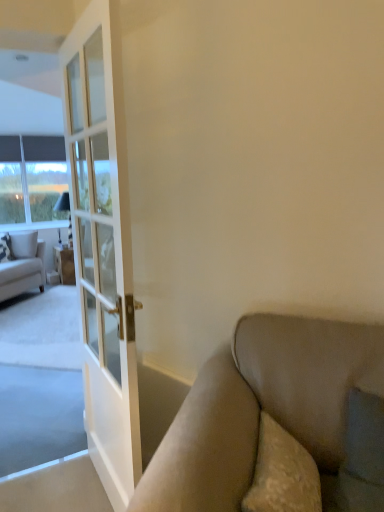
Question: From the image's perspective, is white textured pillow at left, which ranks as the 1th pillow in right-to-left order, positioned above or below patterned fabric pillow at left, acting as the first pillow starting from the left?

Choices:
 (A) above
 (B) below

Answer: (A)

Question: Would you say white textured pillow at left, which ranks as the 1th pillow in right-to-left order, is inside or outside patterned fabric pillow at left, which is the second pillow in right-to-left order?

Choices:
 (A) outside
 (B) inside

Answer: (A)

Question: Which is nearer to the white textured pillow at left, which ranks as the 1th pillow in right-to-left order?

Choices:
 (A) patterned fabric pillow at left, which is the second pillow in right-to-left order
 (B) clear glass window at left
 (C) light beige fabric couch at left
 (D) matte white cabinet at left

Answer: (A)

Question: Based on their relative distances, which object is nearer to the white textured pillow at left, the 2th pillow from the left?

Choices:
 (A) light beige fabric couch at left
 (B) patterned fabric pillow at left, acting as the first pillow starting from the left
 (C) matte white cabinet at left
 (D) clear glass window at left

Answer: (B)